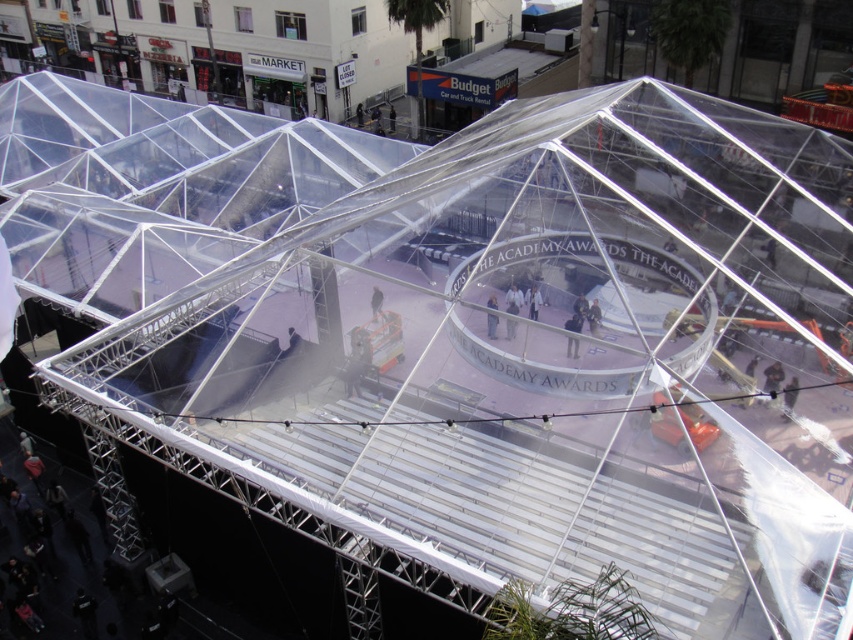
You are an event photographer positioned outside the geodesic dome. You notice two jackets at the center of the dome. Which jacket is nearer to you, the dark gray fabric jacket at center or the light blue denim jacket at center?

The dark gray fabric jacket at center is closer to the viewer than the light blue denim jacket at center, so the dark gray fabric jacket at center is nearer to you.

You are standing outside the geodesic dome and looking at two points marked inside the dome. Which point is closer to you, point (521, 296) or point (577, 323)?

Point (521, 296) is closer to you because it is further to the viewer than point (577, 323).

You are a photographer at the Academy Awards event inside the geodesic dome. You need to capture a photo of both the light brown fabric pants at center and the dark gray fabric jacket at center. From your current position, which one should you adjust your camera angle to the left to include in the frame first?

The light brown fabric pants at center is positioned on the left side of dark gray fabric jacket at center, so you should adjust your camera angle to the left to include the light brown fabric pants at center first.